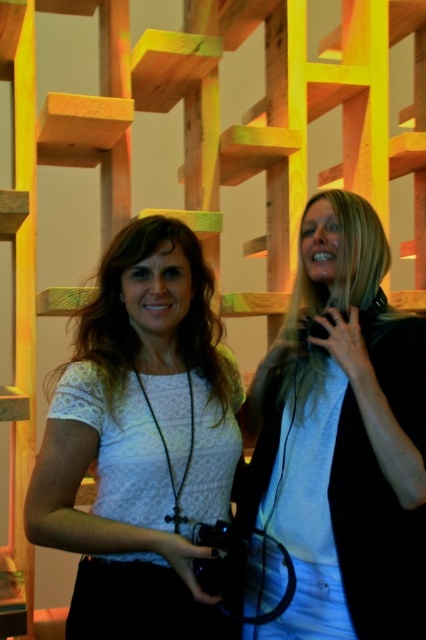
You are a fashion designer observing two garments in the scene. The light blue denim jeans at center and the white lace shirt at center. Which garment is taller?

The light blue denim jeans at center has a greater height compared to the white lace shirt at center.

You are standing 5 feet away from the camera. You want to take a photo of the light blue denim jeans at center. Can you reach the jeans to take the photo without moving?

The light blue denim jeans at center are 4.10 feet away from the camera. Since you are 5 feet away from the camera, you are 0.9 feet behind the jeans. You can reach forward to take the photo without moving your position.

From the picture: You are standing in front of the wooden structure and want to determine the relative depth of two points marked on the structure. Which point, point 1 at coordinates (319, 388) or point 2 at coordinates (112, 420), is closer to you?

Point 1 at coordinates (319, 388) is closer to you because it is further to the viewer than point 2 at coordinates (112, 420).